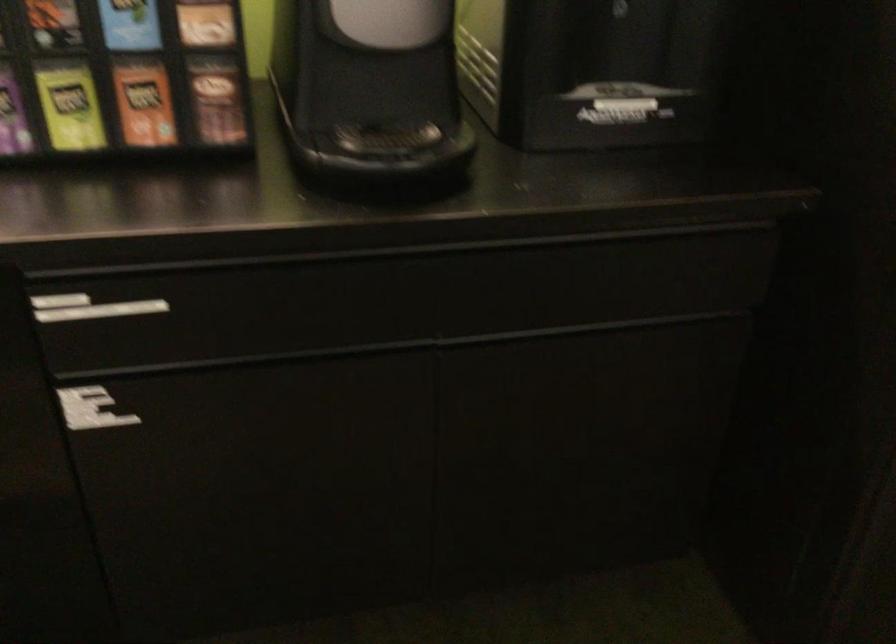
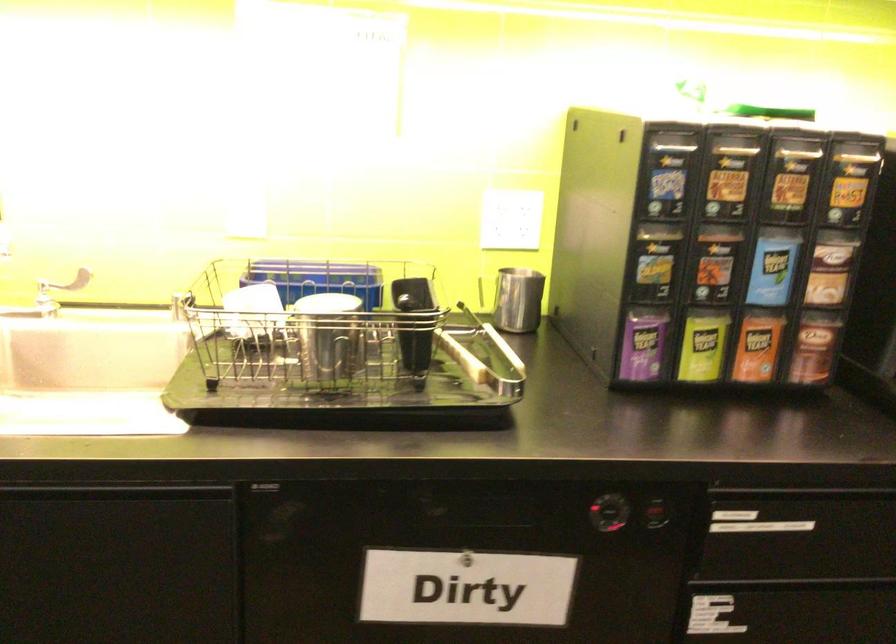
Question: The first image is from the beginning of the video and the second image is from the end. How did the camera likely rotate when shooting the video?

Choices:
 (A) Left
 (B) Right
 (C) Up
 (D) Down

Answer: (C)